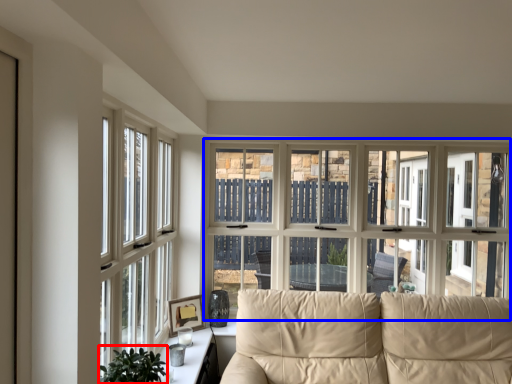
Question: Which object appears closest to the camera in this image, plant (highlighted by a red box) or window (highlighted by a blue box)?

Choices:
 (A) plant
 (B) window

Answer: (A)